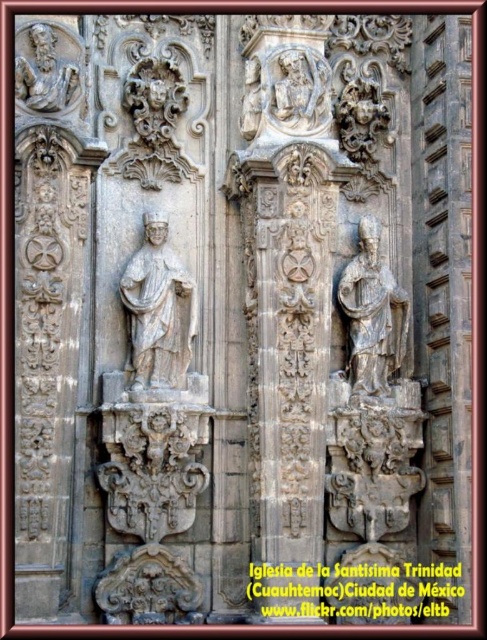
You are an architect planning to install a new decorative element between the white stone statue at center and the gray stone statue at center. The element requires a minimum of 5 meters of space between the statues to be installed safely. Based on the scene, is there enough space?

The white stone statue at center and gray stone statue at center are 4.34 meters apart from each other. Since the required space is 5 meters, there is insufficient space for the installation.

Looking at this image, you are an architect examining the stone facade. You notice two statues, the white stone statue at center and the gray stone statue at center. Which one is positioned higher on the facade?

The white stone statue at center is positioned higher than the gray stone statue at center according to the description.

You are an art historian examining the stone facade. You notice two statues, the white stone statue at center and the gray stone statue at center. Which statue is closer to the viewer?

The white stone statue at center is closer to the viewer because it is positioned in front of the gray stone statue at center.